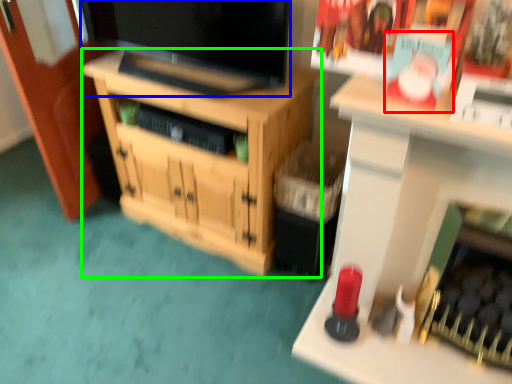
Question: Based on their relative distances, which object is nearer to magazine (highlighted by a red box)? Choose from television (highlighted by a blue box) and cabinetry (highlighted by a green box).

Choices:
 (A) television
 (B) cabinetry

Answer: (A)